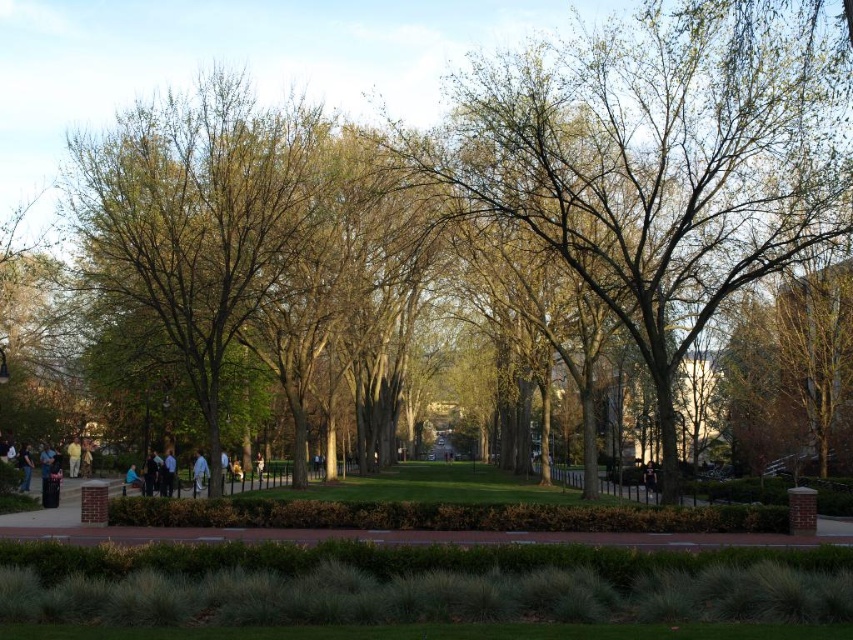
You are standing at the viewpoint of the image and want to walk towards the two points marked in the scene. Which point, point (759, 541) or point (195, 456), would you reach first?

You would reach point (759, 541) first because it is closer to the viewer than point (195, 456).

You are standing at the edge of the park and want to walk from the brown brick path at center to the light blue fabric at center. Given that the distance between them is 45.38 feet, will you need to walk more than 50 feet to reach your destination?

The distance between the brown brick path at center and the light blue fabric at center is 45.38 feet, which is less than 50 feet. Therefore, you will not need to walk more than 50 feet to reach your destination.

You are standing at the edge of the park and notice the brown brick path at center and the light blue fabric at center. Which object is positioned higher from the ground?

The brown brick path at center is much taller than the light blue fabric at center, so the brown brick path at center is positioned higher from the ground.